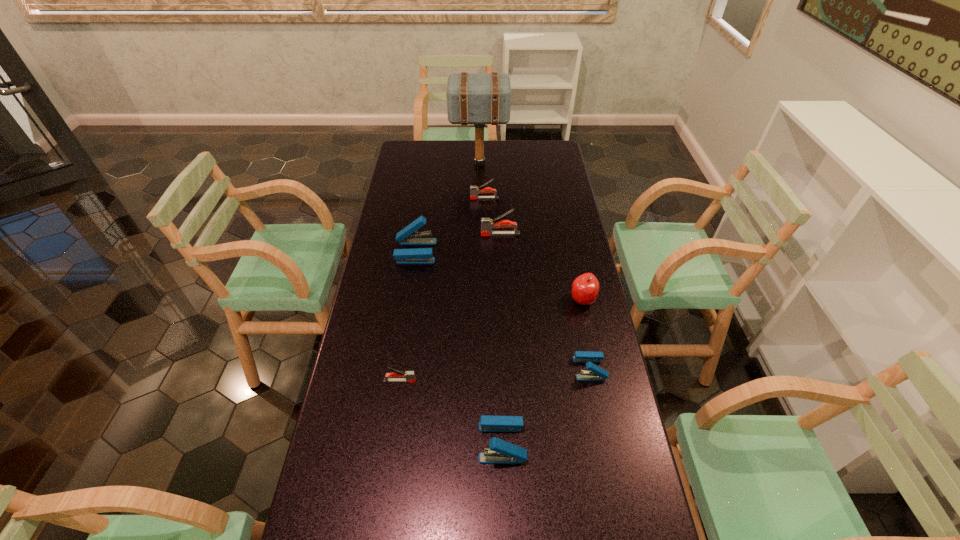
What are the coordinates of `vacant space located on the front of the leftmost blue stapler` in the screenshot? It's located at (402, 342).

The width and height of the screenshot is (960, 540). What are the coordinates of `free region located 0.380m on the left of the fifth farthest object` in the screenshot? It's located at (456, 300).

At what (x,y) coordinates should I click in order to perform the action: click on free space located on the handle side of the farthest stapler. Please return your answer as a coordinate pair (x, y). Looking at the image, I should click on (420, 198).

Identify the location of vacant space positioned 0.340m on the handle side of the farthest stapler. (390, 198).

Locate an element on the screen. The height and width of the screenshot is (540, 960). vacant area situated on the handle side of the farthest stapler is located at coordinates (420, 198).

Where is `vacant area situated 0.210m on the right of the nearest object`? The width and height of the screenshot is (960, 540). vacant area situated 0.210m on the right of the nearest object is located at coordinates (607, 442).

Identify the location of blank space located on the handle side of the nearest gray stapler. (541, 381).

I want to click on vacant space located 0.150m on the left of the rightmost blue stapler, so click(x=523, y=369).

Where is `object at the far edge`? The image size is (960, 540). object at the far edge is located at coordinates (472, 98).

Image resolution: width=960 pixels, height=540 pixels. Find the location of `apple that is at the right edge`. apple that is at the right edge is located at coordinates click(x=585, y=288).